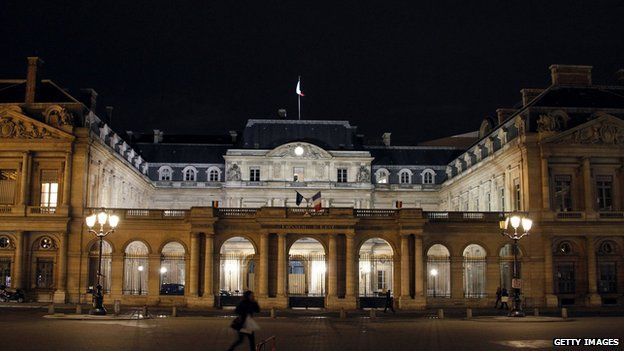
This screenshot has height=351, width=624. I want to click on chimney, so click(x=576, y=78).